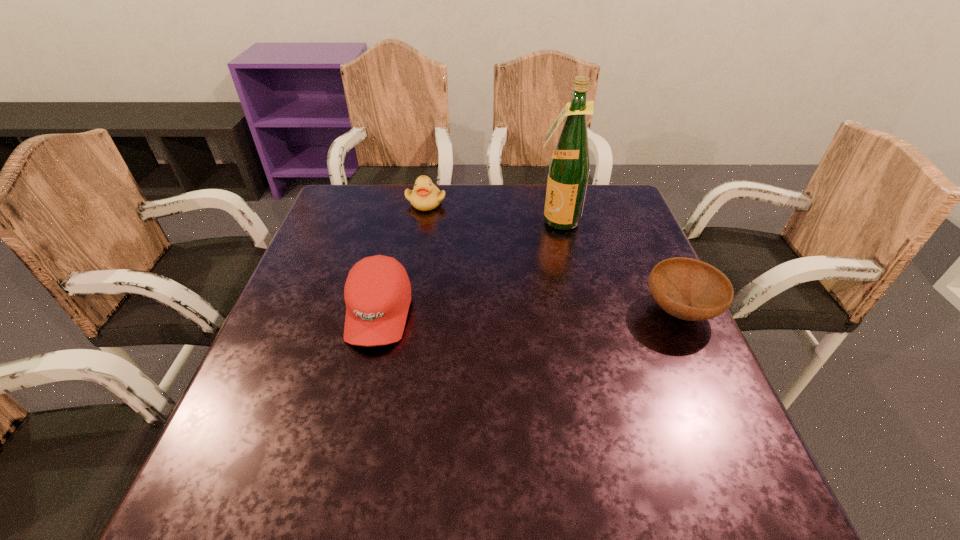
Identify the location of cap. (377, 293).

The height and width of the screenshot is (540, 960). I want to click on the rightmost object, so click(689, 289).

You are a GUI agent. You are given a task and a screenshot of the screen. Output one action in this format:
    pyautogui.click(x=<x>, y=<y>)
    Task: Click on the third object from left to right
    The height and width of the screenshot is (540, 960).
    Given the screenshot: What is the action you would take?
    pos(569,167)

The height and width of the screenshot is (540, 960). I want to click on liquor, so click(x=569, y=167).

At what (x,y) coordinates should I click in order to perform the action: click on duckling. Please return your answer as a coordinate pair (x, y). Image resolution: width=960 pixels, height=540 pixels. Looking at the image, I should click on (425, 196).

Where is `free space located 0.140m on the front-facing side of the cap`? free space located 0.140m on the front-facing side of the cap is located at coordinates (355, 415).

Identify the location of vacant space located 0.150m on the back of the bowl. (650, 246).

Locate an element on the screen. The image size is (960, 540). vacant space located on the front-facing side of the tallest object is located at coordinates (509, 284).

This screenshot has height=540, width=960. I want to click on free region located on the front-facing side of the tallest object, so click(x=488, y=313).

Image resolution: width=960 pixels, height=540 pixels. In order to click on free space located on the front-facing side of the tallest object in this screenshot , I will do `click(521, 267)`.